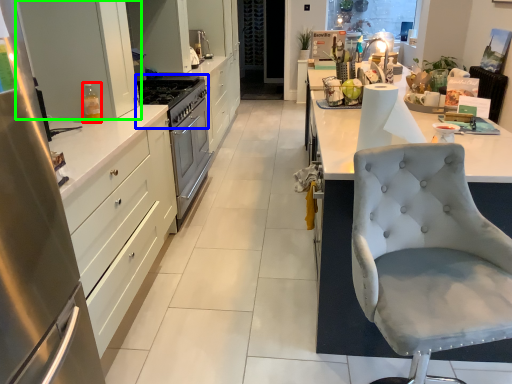
Question: Which object is positioned farthest from bottle (highlighted by a red box)? Select from gas stove (highlighted by a blue box) and cabinetry (highlighted by a green box).

Choices:
 (A) gas stove
 (B) cabinetry

Answer: (A)